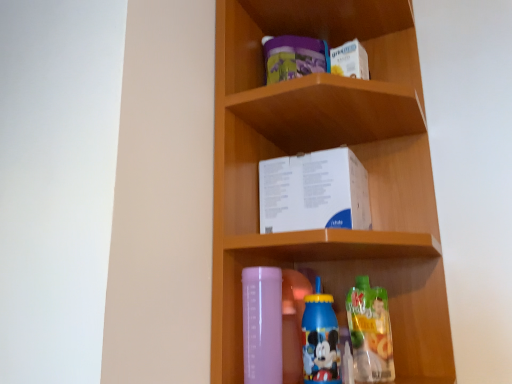
Question: Should I look upward or downward to see white paper box at center?

Choices:
 (A) up
 (B) down

Answer: (B)

Question: Does matte plastic box at center have a larger size compared to white paper box at center?

Choices:
 (A) no
 (B) yes

Answer: (B)

Question: Can you confirm if matte plastic box at center is smaller than white paper box at center?

Choices:
 (A) no
 (B) yes

Answer: (A)

Question: Is matte plastic box at center shorter than white paper box at center?

Choices:
 (A) no
 (B) yes

Answer: (A)

Question: From a real-world perspective, does matte plastic box at center sit lower than white paper box at center?

Choices:
 (A) yes
 (B) no

Answer: (B)

Question: From a real-world perspective, is matte plastic box at center on white paper box at center?

Choices:
 (A) yes
 (B) no

Answer: (A)

Question: Is there a large distance between matte plastic box at center and white paper box at center?

Choices:
 (A) yes
 (B) no

Answer: (B)

Question: Is white paper box at center looking in the opposite direction of matte plastic box at center?

Choices:
 (A) yes
 (B) no

Answer: (A)

Question: From a real-world perspective, is white paper box at center over matte plastic box at center?

Choices:
 (A) no
 (B) yes

Answer: (A)

Question: Would you consider white paper box at center to be distant from matte plastic box at center?

Choices:
 (A) no
 (B) yes

Answer: (A)

Question: From the image's perspective, is white paper box at center located beneath matte plastic box at center?

Choices:
 (A) no
 (B) yes

Answer: (B)

Question: Does white paper box at center have a smaller size compared to matte plastic box at center?

Choices:
 (A) yes
 (B) no

Answer: (A)

Question: Is white paper box at center taller than matte plastic box at center?

Choices:
 (A) no
 (B) yes

Answer: (A)

Question: Considering the relative sizes of matte plastic box at center and blue plastic bottle at lower center, the second bottle in the right-to-left sequence, in the image provided, is matte plastic box at center taller than blue plastic bottle at lower center, the second bottle in the right-to-left sequence,?

Choices:
 (A) yes
 (B) no

Answer: (A)